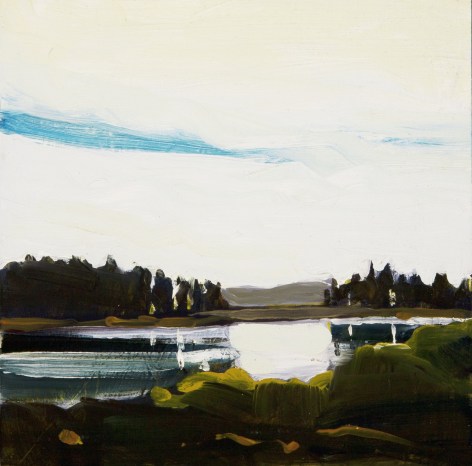
Where is `painting`? This screenshot has width=472, height=466. painting is located at coordinates (293, 326).